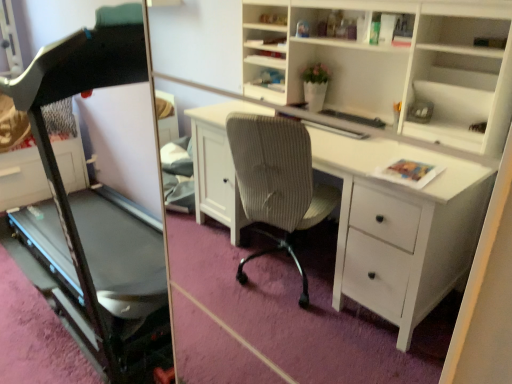
What is the approximate width of black rubber treadmill at left?

It is 31.66 inches.

Identify the location of black rubber treadmill at left. (73, 95).

Image resolution: width=512 pixels, height=384 pixels. Describe the element at coordinates (73, 95) in the screenshot. I see `black rubber treadmill at left` at that location.

At what (x,y) coordinates should I click in order to perform the action: click on black rubber treadmill at left. Please return your answer as a coordinate pair (x, y). This screenshot has width=512, height=384. Looking at the image, I should click on (73, 95).